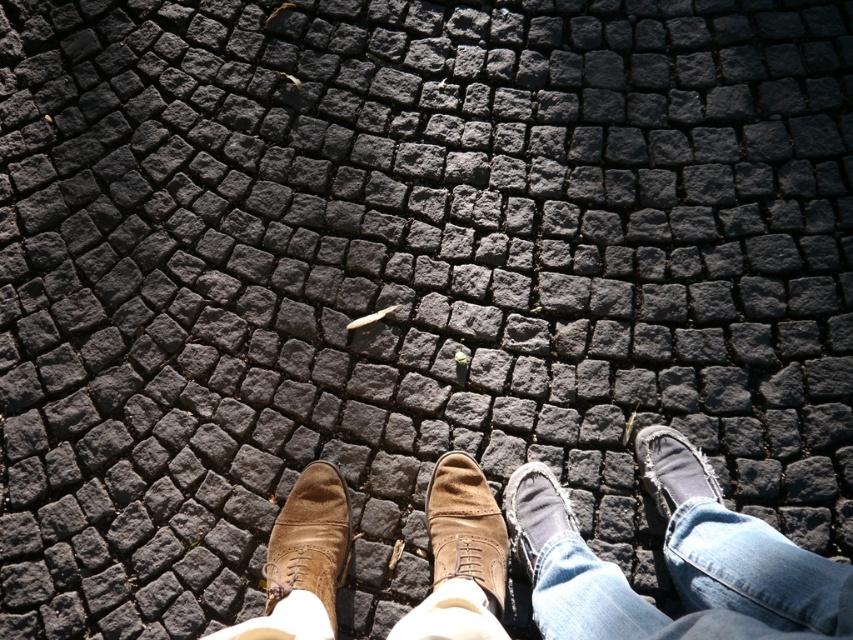
Is point (728, 540) farther from camera compared to point (701, 524)?

No, it is in front of (701, 524).

Is point (759, 572) behind point (587, 602)?

That is False.

I want to click on brown suede shoes at center, so click(x=616, y=564).

Identify the location of jeans at center. This screenshot has width=853, height=640. (695, 586).

Based on the photo, who is taller, jeans at center or leather lace-up shoe at center?

jeans at center is taller.

Is point (810, 604) positioned behind point (514, 500)?

No, (810, 604) is closer to viewer.

At what (x,y) coordinates should I click in order to perform the action: click on jeans at center. Please return your answer as a coordinate pair (x, y). Image resolution: width=853 pixels, height=640 pixels. Looking at the image, I should click on (695, 586).

Can you confirm if brown suede shoes at center is smaller than leather lace-up shoe at center?

No.

Is brown suede shoes at center further to the viewer compared to leather lace-up shoe at center?

No, brown suede shoes at center is in front of leather lace-up shoe at center.

The image size is (853, 640). Identify the location of brown suede shoes at center. (616, 564).